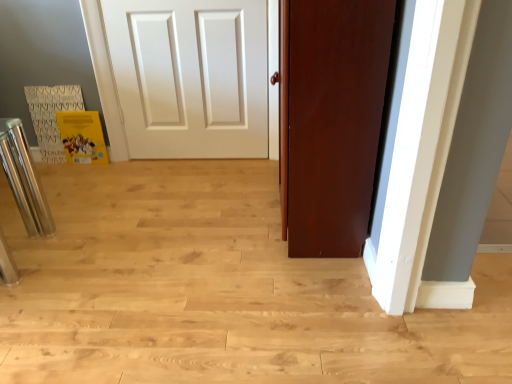
What do you see at coordinates (332, 121) in the screenshot? The width and height of the screenshot is (512, 384). I see `matte brown door at center` at bounding box center [332, 121].

At what (x,y) coordinates should I click in order to perform the action: click on matte brown door at center. Please return your answer as a coordinate pair (x, y). Looking at the image, I should click on (332, 121).

Image resolution: width=512 pixels, height=384 pixels. What do you see at coordinates (24, 179) in the screenshot?
I see `shiny metallic bar stool at left` at bounding box center [24, 179].

Where is `shiny metallic bar stool at left`? shiny metallic bar stool at left is located at coordinates (24, 179).

This screenshot has width=512, height=384. Find the location of `matte brown door at center`. matte brown door at center is located at coordinates (332, 121).

Considering the positions of objects matte brown door at center and shiny metallic bar stool at left in the image provided, who is more to the right, matte brown door at center or shiny metallic bar stool at left?

matte brown door at center.

Relative to shiny metallic bar stool at left, is matte brown door at center in front or behind?

Clearly, matte brown door at center is in front of shiny metallic bar stool at left.

Does point (367, 51) come closer to viewer compared to point (3, 147)?

Yes, point (367, 51) is closer to viewer.

From the image's perspective, is matte brown door at center below shiny metallic bar stool at left?

Actually, matte brown door at center appears above shiny metallic bar stool at left in the image.

From a real-world perspective, is matte brown door at center located beneath shiny metallic bar stool at left?

Actually, matte brown door at center is physically above shiny metallic bar stool at left in the real world.

Is matte brown door at center thinner than shiny metallic bar stool at left?

Correct, the width of matte brown door at center is less than that of shiny metallic bar stool at left.

Considering the relative sizes of matte brown door at center and shiny metallic bar stool at left in the image provided, is matte brown door at center taller than shiny metallic bar stool at left?

Correct, matte brown door at center is much taller as shiny metallic bar stool at left.

Looking at the image, does matte brown door at center seem bigger or smaller compared to shiny metallic bar stool at left?

In the image, matte brown door at center appears to be larger than shiny metallic bar stool at left.

Would you say matte brown door at center is outside shiny metallic bar stool at left?

matte brown door at center is positioned outside shiny metallic bar stool at left.

Is matte brown door at center next to shiny metallic bar stool at left and touching it?

matte brown door at center is not next to shiny metallic bar stool at left, and they're not touching.

Could you tell me if matte brown door at center is facing shiny metallic bar stool at left?

Yes, matte brown door at center is aimed at shiny metallic bar stool at left.

What's the angular difference between matte brown door at center and shiny metallic bar stool at left's facing directions?

The angle between the facing direction of matte brown door at center and the facing direction of shiny metallic bar stool at left is 90.2 degrees.

Where is `bar stool lying behind the matte brown door at center`? The image size is (512, 384). bar stool lying behind the matte brown door at center is located at coordinates (24, 179).

Can you confirm if shiny metallic bar stool at left is positioned to the right of matte brown door at center?

Incorrect, shiny metallic bar stool at left is not on the right side of matte brown door at center.

Looking at this image, is shiny metallic bar stool at left closer to camera compared to matte brown door at center?

No, it is not.

Does point (10, 134) lie behind point (327, 31)?

Yes, point (10, 134) is farther from viewer.

From the image's perspective, is shiny metallic bar stool at left located beneath matte brown door at center?

Yes, from the image's perspective, shiny metallic bar stool at left is below matte brown door at center.

From a real-world perspective, is shiny metallic bar stool at left located higher than matte brown door at center?

No, from a real-world perspective, shiny metallic bar stool at left is not over matte brown door at center

In terms of width, does shiny metallic bar stool at left look wider or thinner when compared to matte brown door at center?

shiny metallic bar stool at left is wider than matte brown door at center.

Does shiny metallic bar stool at left have a lesser height compared to matte brown door at center?

Yes, shiny metallic bar stool at left is shorter than matte brown door at center.

Considering the relative sizes of shiny metallic bar stool at left and matte brown door at center in the image provided, is shiny metallic bar stool at left smaller than matte brown door at center?

Yes.

Is shiny metallic bar stool at left spatially inside matte brown door at center, or outside of it?

The correct answer is: outside.

Is shiny metallic bar stool at left far away from matte brown door at center?

That's right, there is a large distance between shiny metallic bar stool at left and matte brown door at center.

Is shiny metallic bar stool at left turned away from matte brown door at center?

That's not correct — shiny metallic bar stool at left is not looking away from matte brown door at center.

What's the angular difference between shiny metallic bar stool at left and matte brown door at center's facing directions?

The angular difference between shiny metallic bar stool at left and matte brown door at center is 90.2 degrees.

What are the coordinates of `door located on the right of shiny metallic bar stool at left` in the screenshot? It's located at (332, 121).

Identify the location of door that is in front of the shiny metallic bar stool at left. Image resolution: width=512 pixels, height=384 pixels. (332, 121).

In the image, there is a matte brown door at center. At what (x,y) coordinates should I click in order to perform the action: click on bar stool below it (from the image's perspective). Please return your answer as a coordinate pair (x, y). Image resolution: width=512 pixels, height=384 pixels. Looking at the image, I should click on (24, 179).